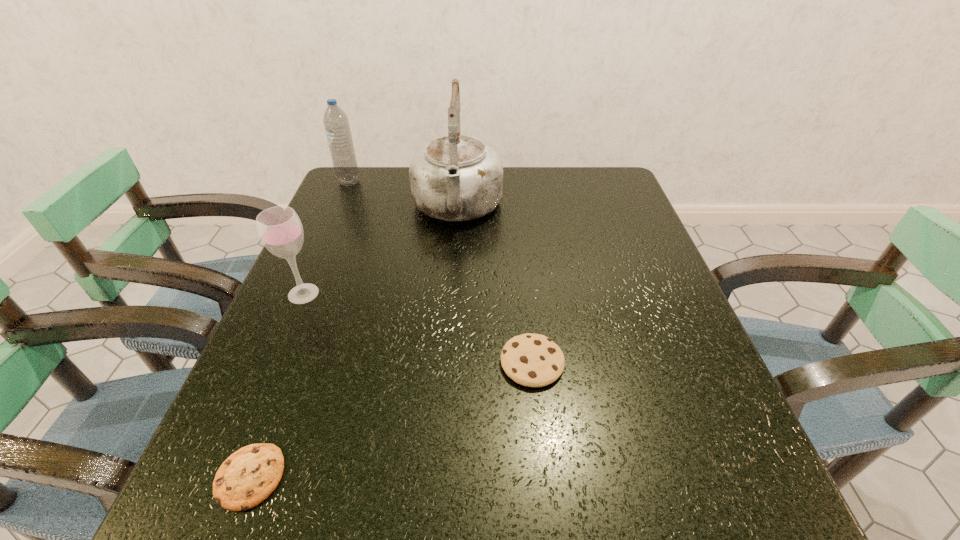
Identify the location of object that stands as the second closest to the tallest object. (280, 230).

This screenshot has height=540, width=960. In order to click on free space that satisfies the following two spatial constraints: 1. at the spout of the tallest object; 2. on the left side of the taller cookie in this screenshot , I will do `click(446, 363)`.

Where is `free region that satisfies the following two spatial constraints: 1. on the front side of the farther cookie; 2. on the left side of the third nearest object`? free region that satisfies the following two spatial constraints: 1. on the front side of the farther cookie; 2. on the left side of the third nearest object is located at coordinates click(274, 363).